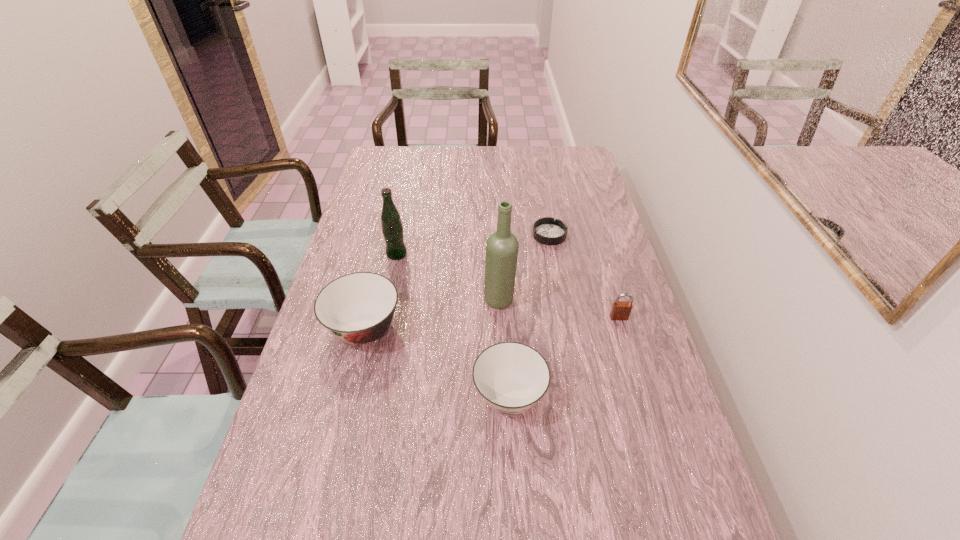
Where is `vacant position located 0.280m on the right of the left soup bowl`? The height and width of the screenshot is (540, 960). vacant position located 0.280m on the right of the left soup bowl is located at coordinates (506, 329).

Locate an element on the screen. Image resolution: width=960 pixels, height=540 pixels. free spot located on the front of the nearer soup bowl is located at coordinates click(x=515, y=486).

The height and width of the screenshot is (540, 960). I want to click on vacant space located 0.260m on the front of the beer bottle, so click(382, 325).

At what (x,y) coordinates should I click in order to perform the action: click on free space located on the front of the shortest object. Please return your answer as a coordinate pair (x, y). Looking at the image, I should click on (559, 287).

Identify the location of blank area located 0.120m on the front-facing side of the rightmost object. (631, 356).

This screenshot has height=540, width=960. Find the location of `vacant point located 0.400m on the back of the tallest object`. vacant point located 0.400m on the back of the tallest object is located at coordinates (495, 210).

Where is `soup bowl that is at the left edge`? The height and width of the screenshot is (540, 960). soup bowl that is at the left edge is located at coordinates (357, 308).

The image size is (960, 540). Find the location of `beer bottle located in the left edge section of the desktop`. beer bottle located in the left edge section of the desktop is located at coordinates (392, 228).

Locate an element on the screen. The image size is (960, 540). ashtray that is at the right edge is located at coordinates (548, 231).

What are the coordinates of `padlock that is positioned at the right edge` in the screenshot? It's located at (621, 310).